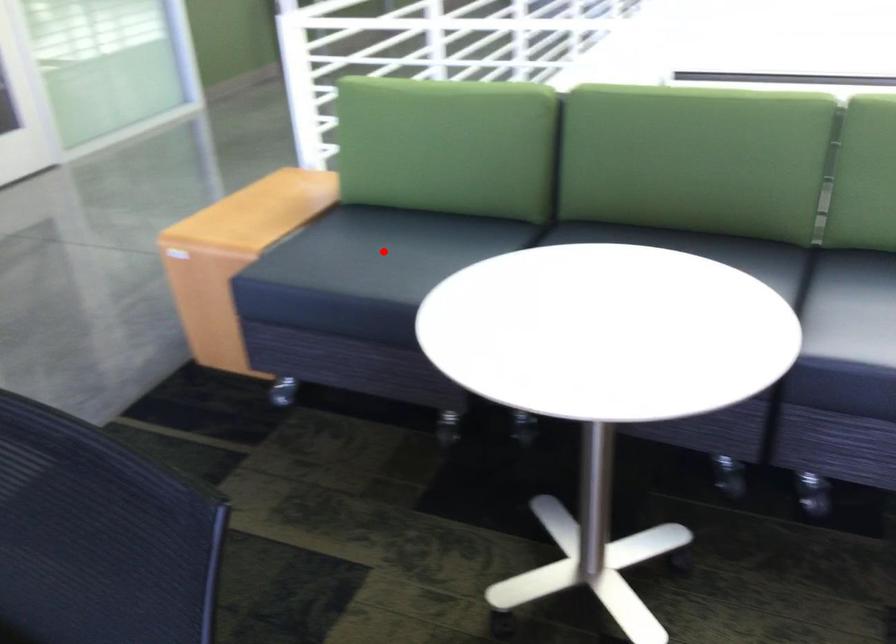
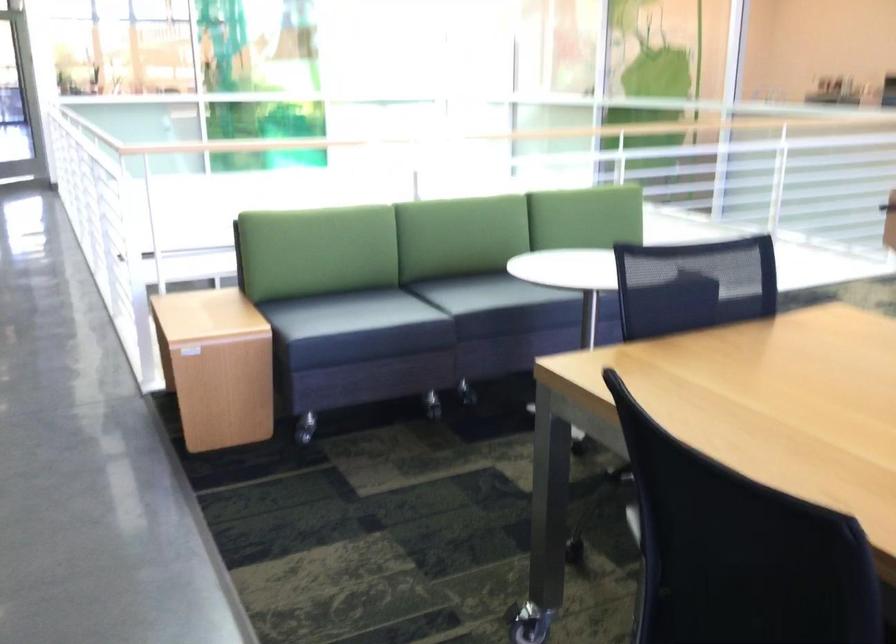
Where in the second image is the point corresponding to the highlighted location from the first image?

(285, 313)